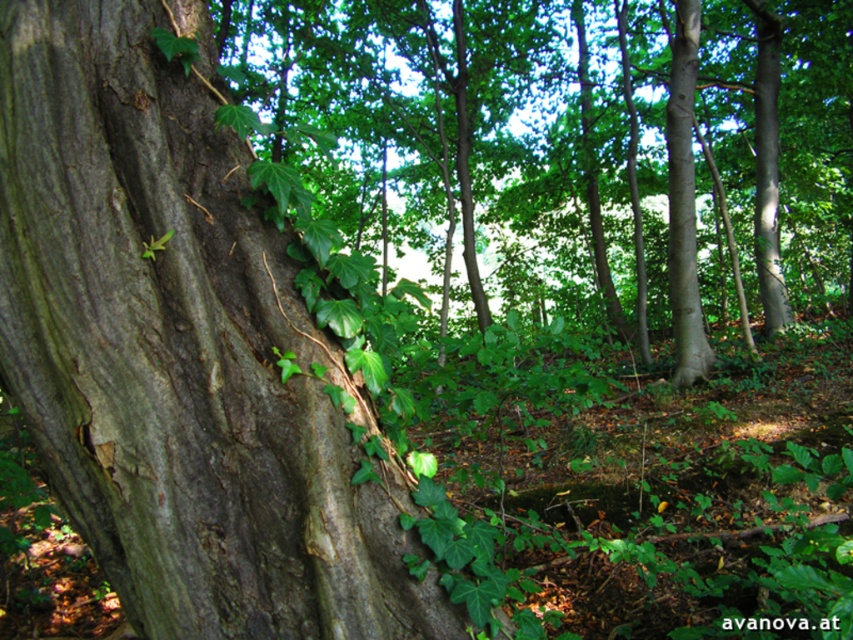
You are a botanist measuring tree trunks in the forest. You have a measuring tape that can only extend up to 2 meters. You see the smooth brown bark at left and the green rough bark tree at center. Which tree trunk can you fully measure with your tape?

The smooth brown bark at left has a smaller width than the green rough bark tree at center, so the botanist can fully measure the smooth brown bark at left with the 2m tape but not the green rough bark tree at center.

You are standing at the point labeled point (x=96, y=125) and want to reach a tree trunk that is 1.26 meters away. Is the tree trunk on your left or right side?

The tree trunk is 1.26 meters away from the point labeled point (x=96, y=125), so it is on the left side since the tree trunk is described as being on the left side of the image.

You are an artist sketching the forest scene. You want to focus on the smooth brown bark at left and the green rough bark tree at center. Which of these two objects should you draw first if you follow the rule of focusing on the larger object first?

The green rough bark tree at center should be drawn first because it occupies more space than the smooth brown bark at left according to the description.